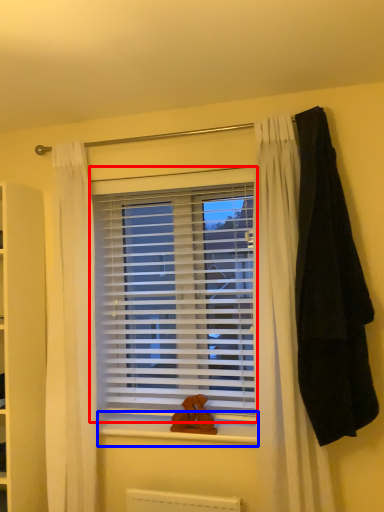
Question: Which object appears closest to the camera in this image, window blind (highlighted by a red box) or window sill (highlighted by a blue box)?

Choices:
 (A) window blind
 (B) window sill

Answer: (B)